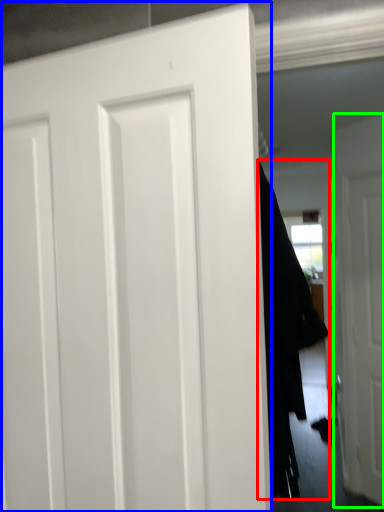
Question: Which object is positioned closest to garment (highlighted by a red box)? Select from door (highlighted by a blue box) and door (highlighted by a green box).

Choices:
 (A) door
 (B) door

Answer: (A)